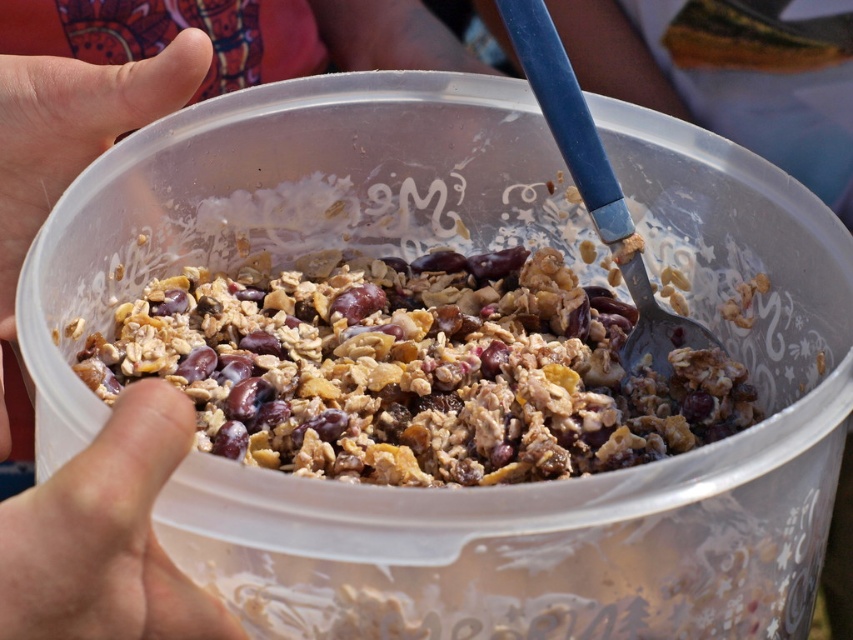
Question: Is brown crunchy granola at center thinner than smooth skin hand at upper left?

Choices:
 (A) no
 (B) yes

Answer: (A)

Question: Which point is farther to the camera?

Choices:
 (A) smooth skin hand at upper left
 (B) brown crunchy granola at center

Answer: (B)

Question: Which is nearer to the brown crunchy granola at center?

Choices:
 (A) flesh-toned skin at lower left
 (B) smooth skin hand at upper left

Answer: (B)

Question: Does flesh-toned skin at lower left lie behind smooth skin hand at upper left?

Choices:
 (A) no
 (B) yes

Answer: (A)

Question: Observing the image, what is the correct spatial positioning of flesh-toned skin at lower left in reference to smooth skin hand at upper left?

Choices:
 (A) left
 (B) right

Answer: (B)

Question: Which of the following is the closest to the observer?

Choices:
 (A) flesh-toned skin at lower left
 (B) brown crunchy granola at center
 (C) smooth skin hand at upper left

Answer: (A)